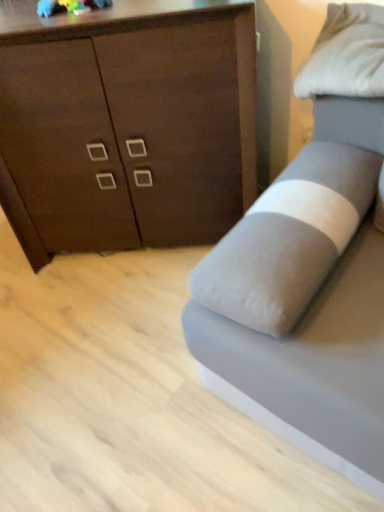
Question: From the image's perspective, is gray fabric studio couch at right above or below dark wood cabinet at upper left?

Choices:
 (A) below
 (B) above

Answer: (A)

Question: Considering the relative positions of gray fabric studio couch at right and dark wood cabinet at upper left in the image provided, is gray fabric studio couch at right to the left or to the right of dark wood cabinet at upper left?

Choices:
 (A) right
 (B) left

Answer: (A)

Question: Which object is positioned farthest from the gray fabric studio couch at right?

Choices:
 (A) white soft pillow at upper right
 (B) dark wood cabinet at upper left

Answer: (B)

Question: Considering the real-world distances, which object is farthest from the white soft pillow at upper right?

Choices:
 (A) gray fabric studio couch at right
 (B) dark wood cabinet at upper left

Answer: (B)